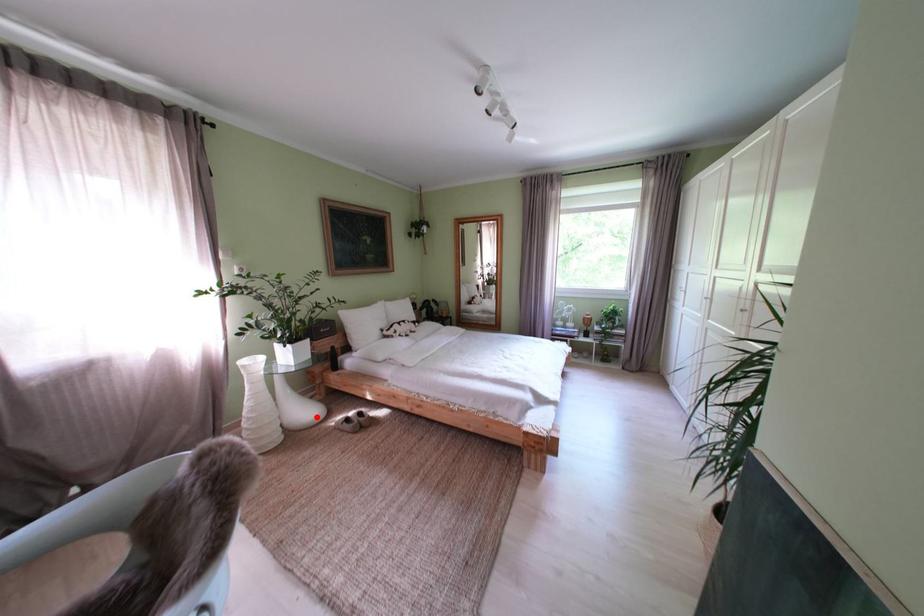
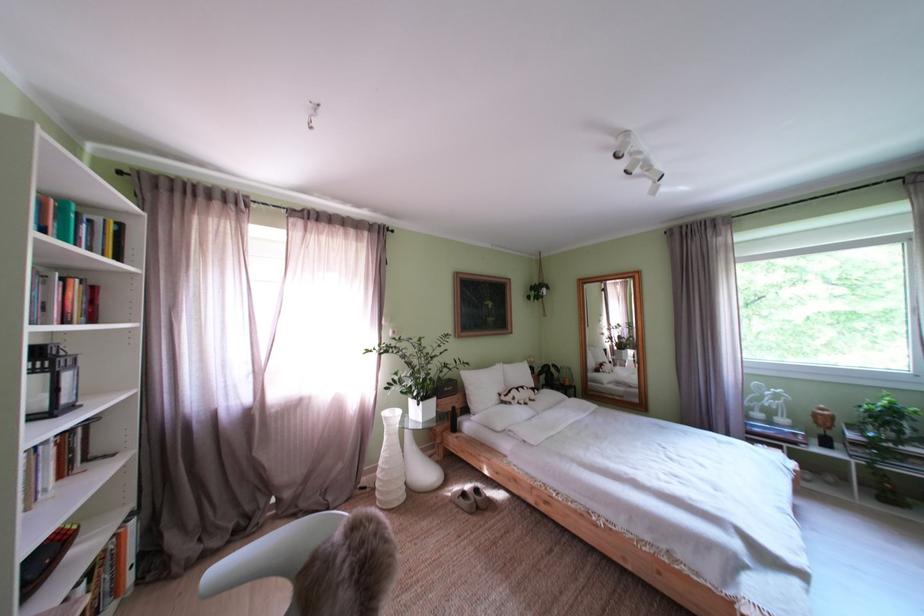
Question: I am providing you with two images of the same scene from different viewpoints. A red point is marked on the first image. Can you still see the location of the red point in image 2?

Choices:
 (A) Yes
 (B) No

Answer: (A)